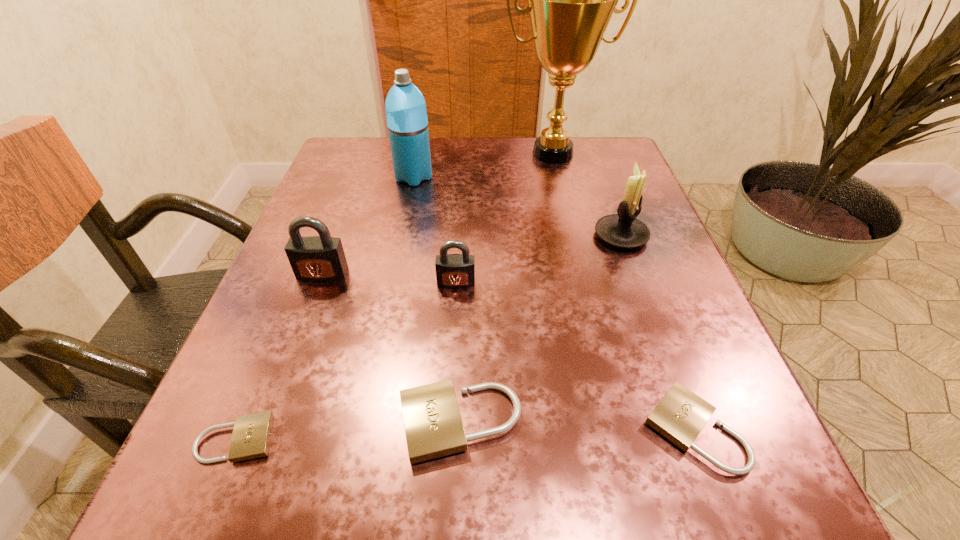
Locate an element on the screen. Image resolution: width=960 pixels, height=540 pixels. award is located at coordinates (570, 0).

The height and width of the screenshot is (540, 960). I want to click on the tallest object, so click(570, 0).

The image size is (960, 540). I want to click on thermos bottle, so click(406, 114).

The width and height of the screenshot is (960, 540). Identify the location of the sixth object from right to left. (406, 114).

Image resolution: width=960 pixels, height=540 pixels. What are the coordinates of `white candle holder` in the screenshot? It's located at (624, 230).

Locate an element on the screen. Image resolution: width=960 pixels, height=540 pixels. candle holder is located at coordinates (624, 230).

Where is `the tallest padlock`? The width and height of the screenshot is (960, 540). the tallest padlock is located at coordinates tap(321, 258).

Locate an element on the screen. Image resolution: width=960 pixels, height=540 pixels. the left gray padlock is located at coordinates (321, 258).

At what (x,y) coordinates should I click in order to perform the action: click on the right gray padlock. Please return your answer as a coordinate pair (x, y). The height and width of the screenshot is (540, 960). Looking at the image, I should click on (455, 271).

The height and width of the screenshot is (540, 960). In order to click on the second tallest padlock in this screenshot , I will do `click(455, 271)`.